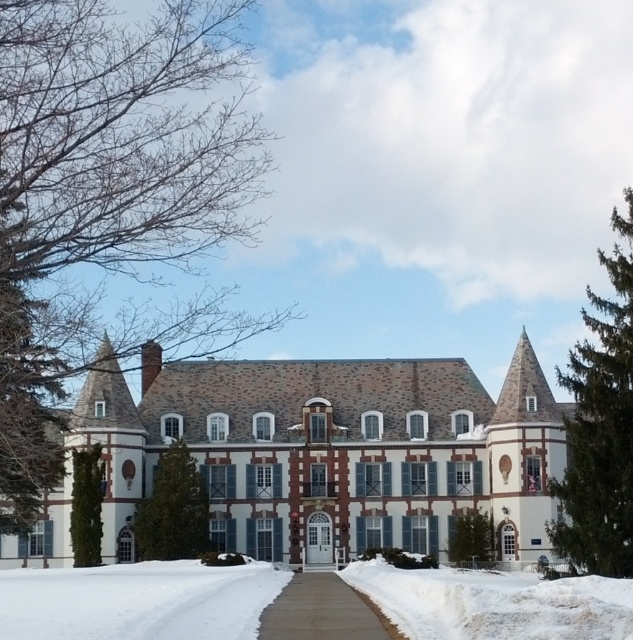
Question: Estimate the real-world distances between objects in this image. Which object is closer to the white stone mansion at center?

Choices:
 (A) white powdery snow at lower right
 (B) brown textured tree at upper left
 (C) gray concrete sidewalk at center

Answer: (B)

Question: Which point is closer to the camera taking this photo?

Choices:
 (A) (104, 477)
 (B) (560, 632)

Answer: (B)

Question: Which object appears farthest from the camera in this image?

Choices:
 (A) green textured tree at right
 (B) green leafy tree at center
 (C) green textured tree at lower center
 (D) brown textured tree at upper left

Answer: (C)

Question: Is the position of brown textured tree at upper left less distant than that of green leafy tree at center?

Choices:
 (A) no
 (B) yes

Answer: (B)

Question: Is white stone mansion at center behind green textured tree at lower center?

Choices:
 (A) no
 (B) yes

Answer: (A)

Question: Does brown textured tree at upper left lie in front of white powdery snow at lower right?

Choices:
 (A) no
 (B) yes

Answer: (A)